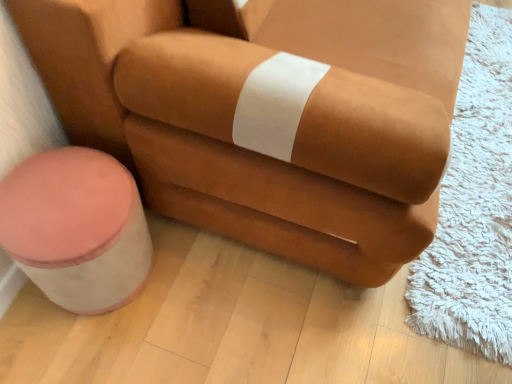
What do you see at coordinates (298, 127) in the screenshot? I see `suede-like brown armchair at center` at bounding box center [298, 127].

In order to face suede-like brown armchair at center, should I rotate leftwards or rightwards?

Turn right approximately 9.655 degrees to face it.

The height and width of the screenshot is (384, 512). In order to click on suede-like brown armchair at center in this screenshot , I will do `click(298, 127)`.

Describe the element at coordinates (76, 227) in the screenshot. I see `pink fabric stool at lower left` at that location.

In order to click on pink fabric stool at lower left in this screenshot , I will do `click(76, 227)`.

Where is `suede-like brown armchair at center`? This screenshot has width=512, height=384. suede-like brown armchair at center is located at coordinates (298, 127).

Considering the positions of objects suede-like brown armchair at center and pink fabric stool at lower left in the image provided, who is more to the left, suede-like brown armchair at center or pink fabric stool at lower left?

Positioned to the left is pink fabric stool at lower left.

Is suede-like brown armchair at center positioned in front of pink fabric stool at lower left?

Yes, suede-like brown armchair at center is closer to the camera.

Which is closer, (130, 91) or (64, 148)?

Point (130, 91).

From the image's perspective, which object appears higher, suede-like brown armchair at center or pink fabric stool at lower left?

suede-like brown armchair at center, from the image's perspective.

From a real-world perspective, who is located lower, suede-like brown armchair at center or pink fabric stool at lower left?

In real-world perspective, pink fabric stool at lower left is lower.

Which object is thinner, suede-like brown armchair at center or pink fabric stool at lower left?

pink fabric stool at lower left is thinner.

From their relative heights in the image, would you say suede-like brown armchair at center is taller or shorter than pink fabric stool at lower left?

Considering their sizes, suede-like brown armchair at center has more height than pink fabric stool at lower left.

Can you confirm if suede-like brown armchair at center is bigger than pink fabric stool at lower left?

Correct, suede-like brown armchair at center is larger in size than pink fabric stool at lower left.

Is suede-like brown armchair at center outside of pink fabric stool at lower left?

Absolutely, suede-like brown armchair at center is external to pink fabric stool at lower left.

Is suede-like brown armchair at center far away from pink fabric stool at lower left?

No.

Is pink fabric stool at lower left at the back of suede-like brown armchair at center?

No, pink fabric stool at lower left is not at the back of suede-like brown armchair at center.

What's the angular difference between suede-like brown armchair at center and pink fabric stool at lower left's facing directions?

1.19 degrees separate the facing orientations of suede-like brown armchair at center and pink fabric stool at lower left.

How distant is suede-like brown armchair at center from pink fabric stool at lower left?

suede-like brown armchair at center is 33.84 centimeters from pink fabric stool at lower left.

Locate an element on the screen. stool directly beneath the suede-like brown armchair at center (from a real-world perspective) is located at coordinates (76, 227).

Does pink fabric stool at lower left appear on the left side of suede-like brown armchair at center?

Yes, pink fabric stool at lower left is to the left of suede-like brown armchair at center.

Considering the positions of objects pink fabric stool at lower left and suede-like brown armchair at center in the image provided, who is in front, pink fabric stool at lower left or suede-like brown armchair at center?

suede-like brown armchair at center.

Is point (46, 196) positioned in front of point (157, 195)?

That is True.

From the image's perspective, is pink fabric stool at lower left above or below suede-like brown armchair at center?

From the image's perspective, pink fabric stool at lower left appears below suede-like brown armchair at center.

From a real-world perspective, is pink fabric stool at lower left over suede-like brown armchair at center?

Actually, pink fabric stool at lower left is physically below suede-like brown armchair at center in the real world.

Which of these two, pink fabric stool at lower left or suede-like brown armchair at center, is wider?

Wider between the two is suede-like brown armchair at center.

Is pink fabric stool at lower left shorter than suede-like brown armchair at center?

Yes, pink fabric stool at lower left is shorter than suede-like brown armchair at center.

Does pink fabric stool at lower left have a smaller size compared to suede-like brown armchair at center?

Yes, pink fabric stool at lower left is smaller than suede-like brown armchair at center.

Is pink fabric stool at lower left not inside suede-like brown armchair at center?

Yes.

Based on the photo, is the surface of pink fabric stool at lower left in direct contact with suede-like brown armchair at center?

pink fabric stool at lower left and suede-like brown armchair at center are not in contact.

Is pink fabric stool at lower left looking in the opposite direction of suede-like brown armchair at center?

That's not correct — pink fabric stool at lower left is not looking away from suede-like brown armchair at center.

What's the angular difference between pink fabric stool at lower left and suede-like brown armchair at center's facing directions?

pink fabric stool at lower left and suede-like brown armchair at center are facing 1.19 degrees away from each other.

How much distance is there between pink fabric stool at lower left and suede-like brown armchair at center?

pink fabric stool at lower left is 13.32 inches away from suede-like brown armchair at center.

At what (x,y) coordinates should I click in order to perform the action: click on chair that is above the pink fabric stool at lower left (from a real-world perspective). Please return your answer as a coordinate pair (x, y). Looking at the image, I should click on (298, 127).

Identify the location of stool below the suede-like brown armchair at center (from a real-world perspective). (76, 227).

The width and height of the screenshot is (512, 384). Find the location of `stool behind the suede-like brown armchair at center`. stool behind the suede-like brown armchair at center is located at coordinates (76, 227).